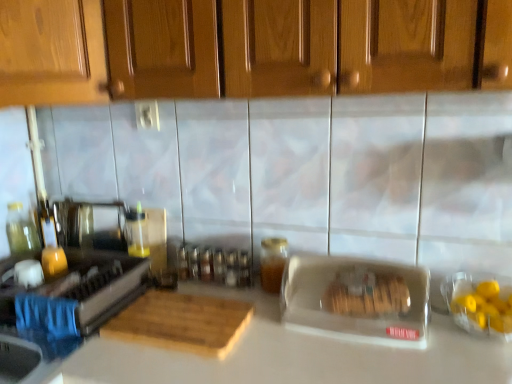
You are a GUI agent. You are given a task and a screenshot of the screen. Output one action in this format:
    pyautogui.click(x=<x>, y=<y>)
    Task: Click on the free space in front of clear plastic container at center, the 2th appliance positioned from the left
    
    Given the screenshot: What is the action you would take?
    pyautogui.click(x=388, y=370)